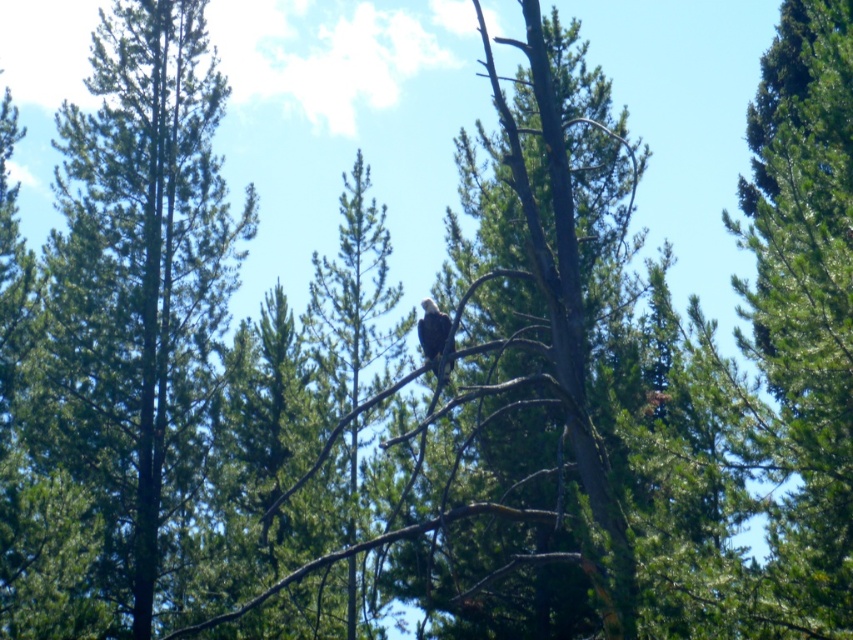
Looking at this image, between green textured tree at left and white feathered eagle at center, which one appears on the left side from the viewer's perspective?

green textured tree at left

Does green textured tree at left have a larger size compared to white feathered eagle at center?

Yes, green textured tree at left is bigger than white feathered eagle at center.

You are a GUI agent. You are given a task and a screenshot of the screen. Output one action in this format:
    pyautogui.click(x=<x>, y=<y>)
    Task: Click on the green textured tree at left
    This screenshot has width=853, height=640.
    Given the screenshot: What is the action you would take?
    pyautogui.click(x=140, y=275)